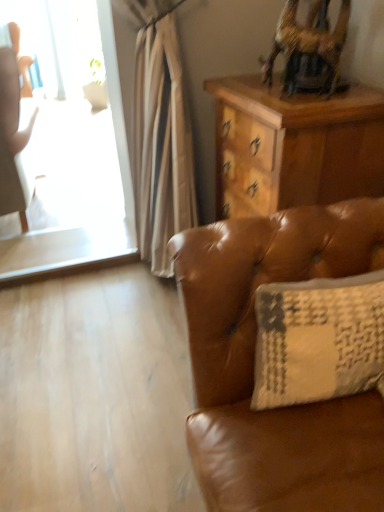
The height and width of the screenshot is (512, 384). I want to click on beige textured pillow at right, so click(318, 339).

The height and width of the screenshot is (512, 384). What do you see at coordinates (294, 146) in the screenshot?
I see `wooden desk at upper right` at bounding box center [294, 146].

The width and height of the screenshot is (384, 512). In order to click on matte white chair at left in this screenshot , I will do `click(12, 137)`.

Identify the location of wooden swivel chair at upper right. point(308,48).

Based on the photo, is wooden swivel chair at upper right at the right side of matte white chair at left?

Yes.

From a real-world perspective, which is physically below, wooden swivel chair at upper right or matte white chair at left?

matte white chair at left, from a real-world perspective.

From the image's perspective, which is above, wooden swivel chair at upper right or matte white chair at left?

matte white chair at left appears higher in the image.

Between wooden desk at upper right and wooden swivel chair at upper right, which one has less height?

With less height is wooden swivel chair at upper right.

Is the position of wooden desk at upper right more distant than that of wooden swivel chair at upper right?

Yes, wooden desk at upper right is behind wooden swivel chair at upper right.

Is wooden desk at upper right not close to wooden swivel chair at upper right?

No, wooden desk at upper right is not far from wooden swivel chair at upper right.

From a real-world perspective, is wooden desk at upper right positioned under wooden swivel chair at upper right based on gravity?

Yes, from a real-world perspective, wooden desk at upper right is under wooden swivel chair at upper right.

Is matte white chair at left turned away from beige textured pillow at right?

matte white chair at left is not turned away from beige textured pillow at right.

How distant is matte white chair at left from beige textured pillow at right?

They are 6.41 feet apart.

Is matte white chair at left to the left of beige textured pillow at right from the viewer's perspective?

Correct, you'll find matte white chair at left to the left of beige textured pillow at right.

In the image, is matte white chair at left positioned in front of or behind beige textured pillow at right?

matte white chair at left is behind beige textured pillow at right.

Considering the positions of points (267, 300) and (318, 194), is point (267, 300) farther from camera compared to point (318, 194)?

That is False.

Is beige textured pillow at right not within wooden desk at upper right?

Yes, beige textured pillow at right is not within wooden desk at upper right.

From the image's perspective, between beige textured pillow at right and wooden desk at upper right, who is located below?

beige textured pillow at right.

Is beige textured pillow at right touching wooden desk at upper right?

No, beige textured pillow at right is not with wooden desk at upper right.

Are wooden swivel chair at upper right and beige textured pillow at right beside each other?

No.

Does wooden swivel chair at upper right have a smaller size compared to beige textured pillow at right?

Correct, wooden swivel chair at upper right occupies less space than beige textured pillow at right.

Which of these two, wooden swivel chair at upper right or beige textured pillow at right, stands shorter?

Standing shorter between the two is wooden swivel chair at upper right.

Is wooden swivel chair at upper right oriented away from wooden desk at upper right?

No, wooden swivel chair at upper right is not facing the opposite direction of wooden desk at upper right.

Is point (326, 30) positioned in front of point (305, 163)?

No, (326, 30) is behind (305, 163).

Between wooden swivel chair at upper right and wooden desk at upper right, which one appears on the right side from the viewer's perspective?

Positioned to the right is wooden desk at upper right.

Locate an element on the screen. This screenshot has height=512, width=384. swivel chair that appears above the wooden desk at upper right (from the image's perspective) is located at coordinates (308, 48).

Does beige textured pillow at right appear on the right side of wooden swivel chair at upper right?

No, beige textured pillow at right is not to the right of wooden swivel chair at upper right.

Find the location of `swivel chair above the beige textured pillow at right (from the image's perspective)`. swivel chair above the beige textured pillow at right (from the image's perspective) is located at coordinates (308, 48).

Is point (366, 344) farther from camera compared to point (311, 47)?

No.

There is a matte white chair at left. Where is `swivel chair above it (from a real-world perspective)`? This screenshot has height=512, width=384. swivel chair above it (from a real-world perspective) is located at coordinates (308, 48).

Identify the location of desk located on the right of wooden swivel chair at upper right. The width and height of the screenshot is (384, 512). (294, 146).

Based on their spatial positions, is beige textured pillow at right or wooden desk at upper right closer to wooden swivel chair at upper right?

wooden desk at upper right is positioned closer to the anchor wooden swivel chair at upper right.

In the scene shown: Which object lies nearer to the anchor point matte white chair at left, wooden desk at upper right or beige textured pillow at right?

wooden desk at upper right.

From the image, which object appears to be nearer to wooden swivel chair at upper right, matte white chair at left or wooden desk at upper right?

wooden desk at upper right is positioned closer to the anchor wooden swivel chair at upper right.

Which object lies further to the anchor point wooden swivel chair at upper right, matte white chair at left or beige textured pillow at right?

matte white chair at left is further to wooden swivel chair at upper right.

When comparing their distances from beige textured pillow at right, does matte white chair at left or wooden swivel chair at upper right seem closer?

Based on the image, wooden swivel chair at upper right appears to be nearer to beige textured pillow at right.

From the image, which object appears to be nearer to wooden swivel chair at upper right, beige textured pillow at right or matte white chair at left?

The object closer to wooden swivel chair at upper right is beige textured pillow at right.

Which object lies further to the anchor point wooden desk at upper right, wooden swivel chair at upper right or beige textured pillow at right?

Among the two, beige textured pillow at right is located further to wooden desk at upper right.

Looking at the image, which one is located closer to matte white chair at left, wooden swivel chair at upper right or wooden desk at upper right?

wooden desk at upper right.

Find the location of a particular element. Image resolution: width=384 pixels, height=512 pixels. pillow situated between matte white chair at left and wooden swivel chair at upper right from left to right is located at coordinates (318, 339).

Where is `swivel chair located between matte white chair at left and wooden desk at upper right in the left-right direction`? The height and width of the screenshot is (512, 384). swivel chair located between matte white chair at left and wooden desk at upper right in the left-right direction is located at coordinates (308, 48).

Find the location of a particular element. Image resolution: width=384 pixels, height=512 pixels. desk between wooden swivel chair at upper right and beige textured pillow at right in the up-down direction is located at coordinates (294, 146).

Locate an element on the screen. pillow between matte white chair at left and wooden desk at upper right is located at coordinates (318, 339).